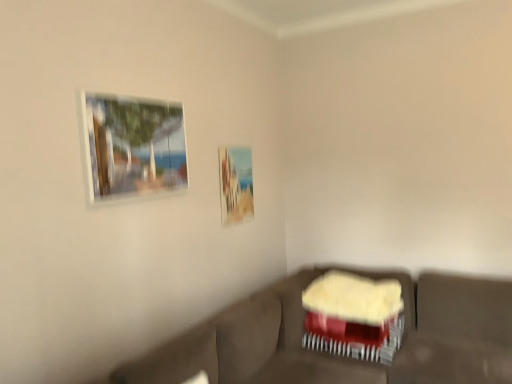
Question: Considering their positions, is matte wooden picture frame at upper center, the first picture frame positioned from the right, located in front of or behind matte glass picture frame at upper left, the 1th picture frame positioned from the front?

Choices:
 (A) front
 (B) behind

Answer: (B)

Question: From the image's perspective, relative to matte glass picture frame at upper left, the second picture frame when ordered from back to front, is matte wooden picture frame at upper center, acting as the 1th picture frame starting from the back, above or below?

Choices:
 (A) above
 (B) below

Answer: (B)

Question: Based on their relative distances, which object is farther from the matte wooden picture frame at upper center, the first picture frame positioned from the right?

Choices:
 (A) velvet brown couch at lower center
 (B) velvet red swivel chair at lower right
 (C) matte glass picture frame at upper left, the 1th picture frame positioned from the front

Answer: (A)

Question: Estimate the real-world distances between objects in this image. Which object is farther from the matte wooden picture frame at upper center, acting as the 1th picture frame starting from the back?

Choices:
 (A) matte glass picture frame at upper left, the second picture frame when ordered from back to front
 (B) velvet brown couch at lower center
 (C) velvet red swivel chair at lower right

Answer: (B)